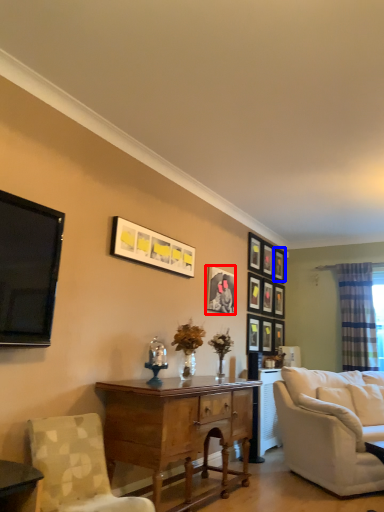
Question: Which object appears closest to the camera in this image, picture frame (highlighted by a red box) or picture frame (highlighted by a blue box)?

Choices:
 (A) picture frame
 (B) picture frame

Answer: (A)